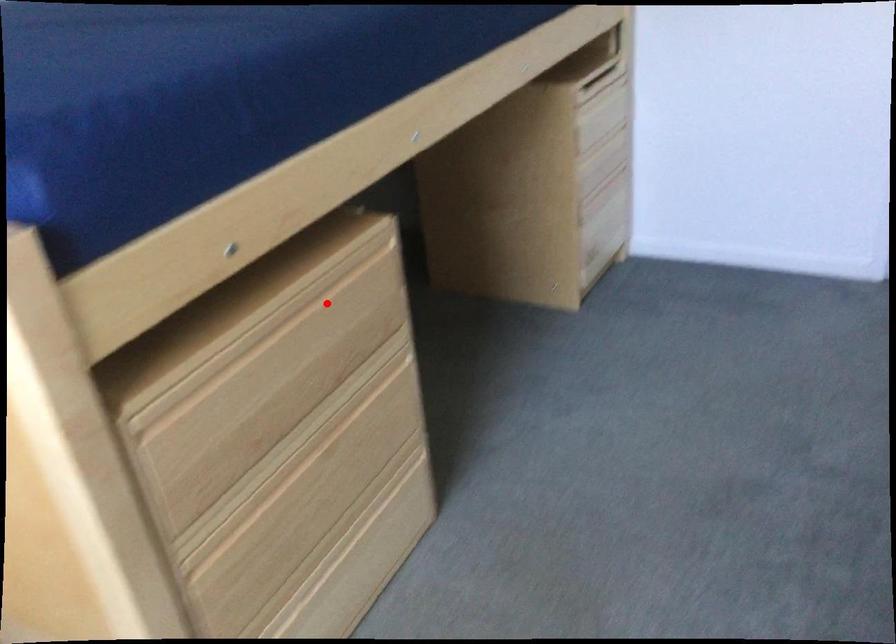
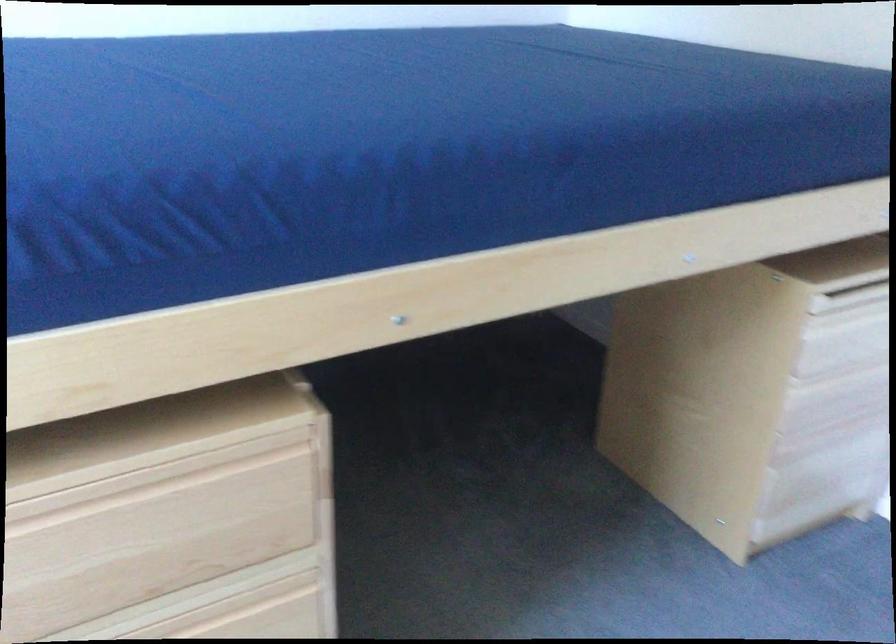
Find the pixel in the second image that matches the highlighted location in the first image.

(174, 494)